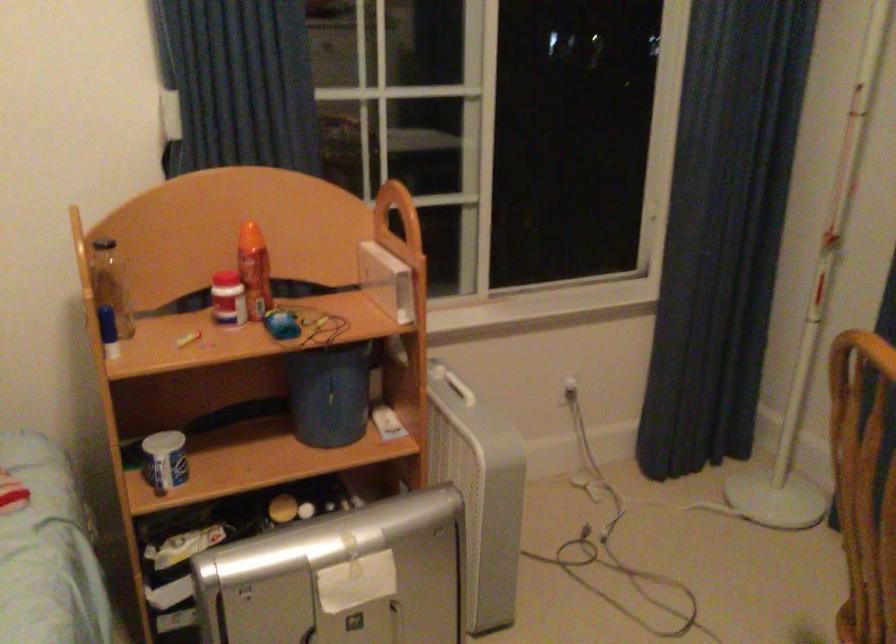
Locate an element on the screen. blue bucket is located at coordinates (331, 395).